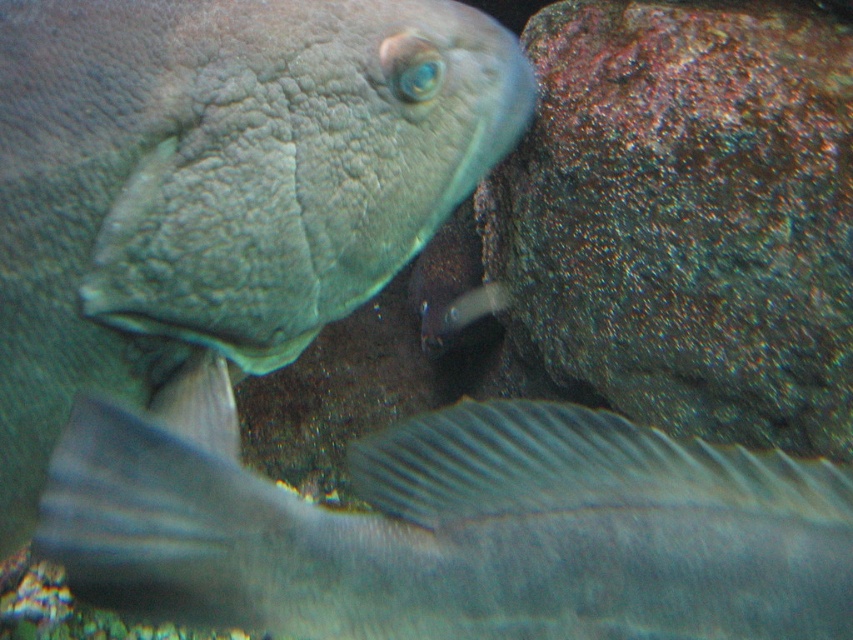
Question: Is smooth gray fish at upper left further to camera compared to rusty rock at right?

Choices:
 (A) no
 (B) yes

Answer: (A)

Question: Is silvery textured fish at lower center to the right of rusty rock at right from the viewer's perspective?

Choices:
 (A) no
 (B) yes

Answer: (A)

Question: Considering the real-world distances, which object is farthest from the smooth gray fish at upper left?

Choices:
 (A) rusty rock at right
 (B) silvery textured fish at lower center

Answer: (A)

Question: Which object is positioned farthest from the rusty rock at right?

Choices:
 (A) smooth gray fish at upper left
 (B) silvery textured fish at lower center

Answer: (B)

Question: Is smooth gray fish at upper left to the right of silvery textured fish at lower center from the viewer's perspective?

Choices:
 (A) yes
 (B) no

Answer: (B)

Question: Which point is farther to the camera?

Choices:
 (A) silvery textured fish at lower center
 (B) smooth gray fish at upper left

Answer: (B)